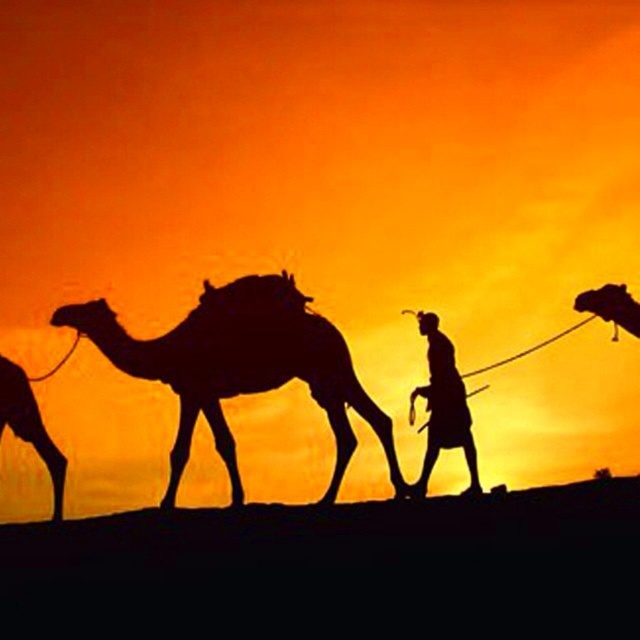
Question: Can you confirm if silhouette camel at center is positioned to the right of silhouette camel at left?

Choices:
 (A) yes
 (B) no

Answer: (A)

Question: Which of these objects is positioned farthest from the silhouette camel at center?

Choices:
 (A) silhouette camel at left
 (B) silhouette figure at center

Answer: (A)

Question: Which point is closer to the camera?

Choices:
 (A) silhouette figure at center
 (B) silhouette camel at left

Answer: (A)

Question: Is silhouette camel at center to the right of silhouette camel at left from the viewer's perspective?

Choices:
 (A) no
 (B) yes

Answer: (B)

Question: Does silhouette camel at center appear on the left side of silhouette camel at left?

Choices:
 (A) no
 (B) yes

Answer: (A)

Question: Which point is farther from the camera taking this photo?

Choices:
 (A) (433, 435)
 (B) (4, 392)
 (C) (595, 292)
 (D) (388, 436)

Answer: (B)